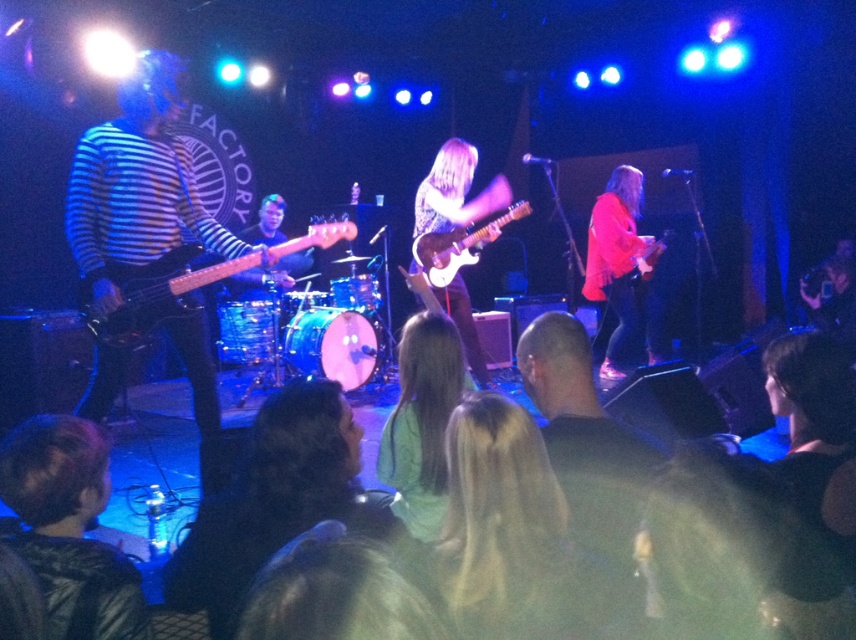
Is matte pink sweater at right above matte black electric guitar at center?

No, matte pink sweater at right is not above matte black electric guitar at center.

Is point (599, 298) positioned before point (649, 237)?

Yes, point (599, 298) is closer to viewer.

Image resolution: width=856 pixels, height=640 pixels. Find the location of `matte pink sweater at right`. matte pink sweater at right is located at coordinates (617, 268).

Is matte pink sweater at right smaller than white glossy electric guitar at center?

No.

Can you confirm if matte pink sweater at right is positioned to the right of white glossy electric guitar at center?

Correct, you'll find matte pink sweater at right to the right of white glossy electric guitar at center.

Between point (626, 209) and point (443, 234), which one is positioned behind?

Positioned behind is point (626, 209).

Where is `matte pink sweater at right`? The image size is (856, 640). matte pink sweater at right is located at coordinates (617, 268).

Between point (467, 147) and point (519, 204), which one is positioned behind?

The point (467, 147) is more distant.

Can you confirm if glossy electric guitar at center is wider than white glossy electric guitar at center?

In fact, glossy electric guitar at center might be narrower than white glossy electric guitar at center.

The height and width of the screenshot is (640, 856). What do you see at coordinates (455, 192) in the screenshot?
I see `glossy electric guitar at center` at bounding box center [455, 192].

Locate an element on the screen. The height and width of the screenshot is (640, 856). glossy electric guitar at center is located at coordinates (455, 192).